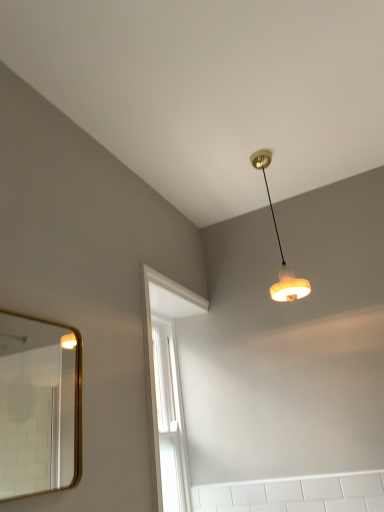
Question: From a real-world perspective, relative to matte orange lampshade at upper center, is gold-framed mirror at left vertically above or below?

Choices:
 (A) above
 (B) below

Answer: (B)

Question: Considering the positions of gold-framed mirror at left and matte orange lampshade at upper center in the image, is gold-framed mirror at left bigger or smaller than matte orange lampshade at upper center?

Choices:
 (A) big
 (B) small

Answer: (B)

Question: Is point (26, 421) positioned closer to the camera than point (256, 160)?

Choices:
 (A) closer
 (B) farther

Answer: (B)

Question: Considering the positions of point (291, 283) and point (64, 420), is point (291, 283) closer or farther from the camera than point (64, 420)?

Choices:
 (A) farther
 (B) closer

Answer: (B)

Question: From a real-world perspective, relative to gold-framed mirror at left, is matte orange lampshade at upper center vertically above or below?

Choices:
 (A) above
 (B) below

Answer: (A)

Question: Relative to gold-framed mirror at left, is matte orange lampshade at upper center in front or behind?

Choices:
 (A) behind
 (B) front

Answer: (A)

Question: Is matte orange lampshade at upper center bigger or smaller than gold-framed mirror at left?

Choices:
 (A) small
 (B) big

Answer: (B)